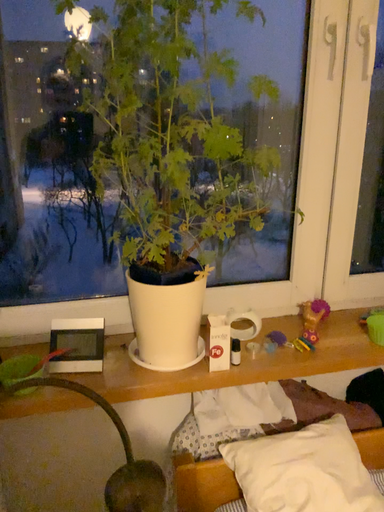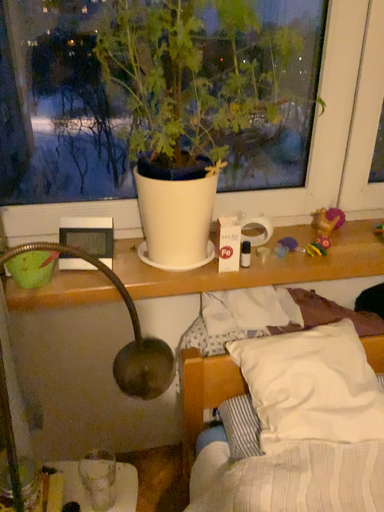
Question: How did the camera likely rotate when shooting the video?

Choices:
 (A) rotated upward
 (B) rotated downward

Answer: (B)